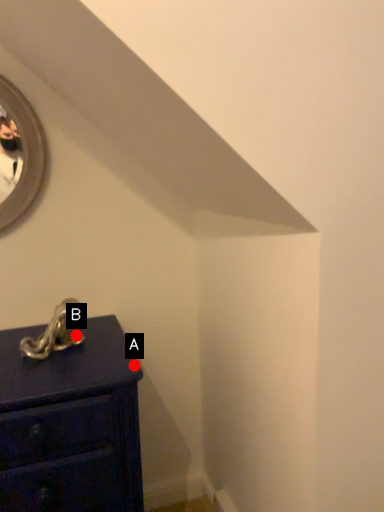
Question: Two points are circled on the image, labeled by A and B beside each circle. Which point is closer to the camera?

Choices:
 (A) A is closer
 (B) B is closer

Answer: (A)